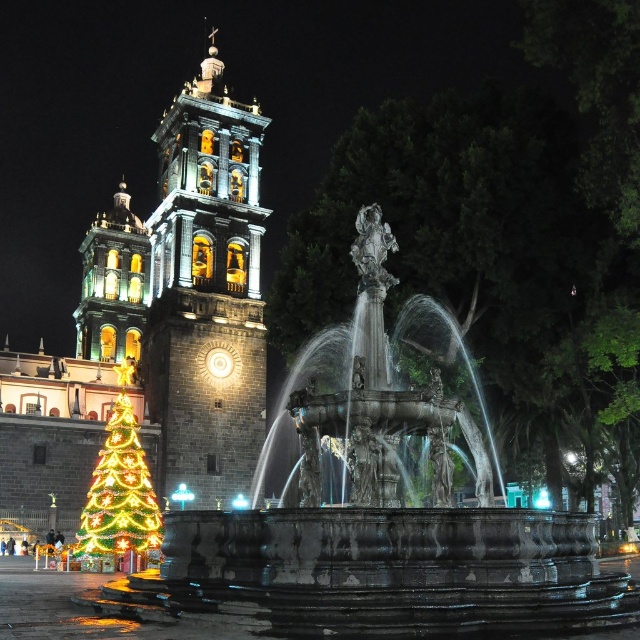
Question: Which point is closer to the camera?

Choices:
 (A) polished stone tower at center
 (B) matte gray church at center
 (C) illuminated plastic christmas tree at lower left

Answer: (C)

Question: Does polished stone fountain at center lie behind illuminated plastic christmas tree at lower left?

Choices:
 (A) no
 (B) yes

Answer: (A)

Question: Does polished stone fountain at center have a greater width compared to matte gray church at center?

Choices:
 (A) no
 (B) yes

Answer: (A)

Question: Estimate the real-world distances between objects in this image. Which object is closer to the polished stone fountain at center?

Choices:
 (A) illuminated plastic christmas tree at lower left
 (B) matte gray church at center
 (C) polished stone tower at center

Answer: (A)

Question: Which object is closer to the camera taking this photo?

Choices:
 (A) illuminated plastic christmas tree at lower left
 (B) matte gray church at center
 (C) polished stone tower at center
 (D) polished stone fountain at center

Answer: (D)

Question: Can you confirm if matte gray church at center is positioned to the right of polished stone tower at center?

Choices:
 (A) no
 (B) yes

Answer: (A)